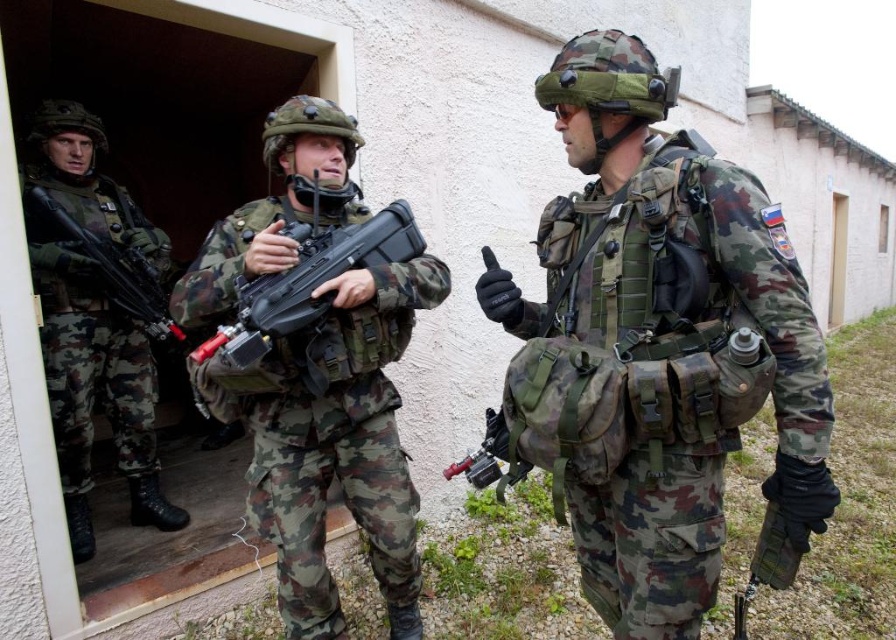
You are a photographer positioned at the back of the scene. You want to take a clear photo of both the camouflage fabric uniform at center and the camouflage fabric rifle at left. Which object will appear larger in your photo?

The camouflage fabric uniform at center will appear larger in the photo because it is closer to the viewer than the camouflage fabric rifle at left.

You are a military trainee observing the scene. You need to locate the camouflage fabric rifle at left for an exercise. According to the coordinates provided, where exactly is it positioned in the image?

The camouflage fabric rifle at left is located at point coordinates 0.500 on the x axis and 0.104 on the y axis.